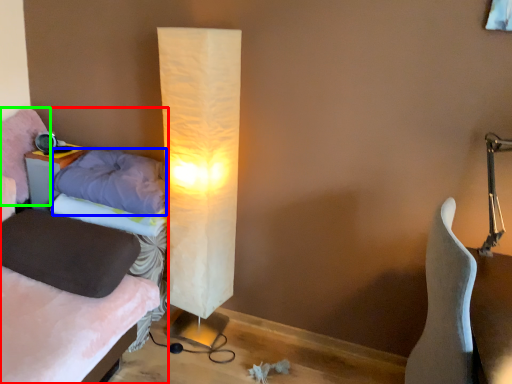
Question: Based on their relative distances, which object is farther from bed (highlighted by a red box)? Choose from pillow (highlighted by a blue box) and pillow (highlighted by a green box).

Choices:
 (A) pillow
 (B) pillow

Answer: (B)